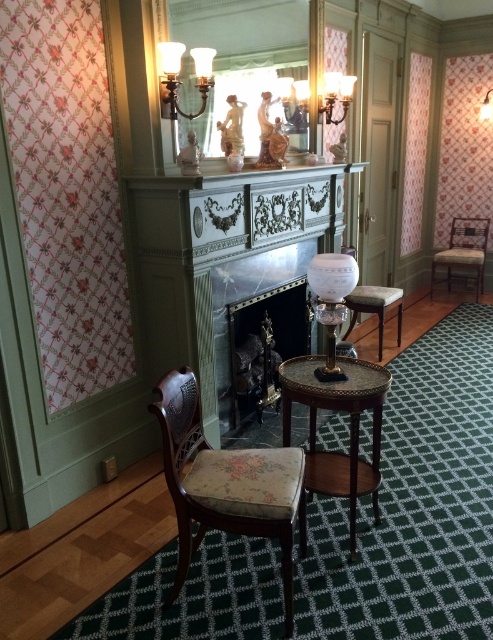
Is point (239, 170) less distant than point (176, 102)?

No, it is not.

Is point (188, 168) closer to viewer compared to point (183, 51)?

No, (188, 168) is behind (183, 51).

Find the location of a particular element. The image size is (493, 640). white marble fireplace at center is located at coordinates (235, 173).

Can you confirm if floral fabric armchair at lower left is bigger than wooden stool at center?

Actually, floral fabric armchair at lower left might be smaller than wooden stool at center.

Which of these two, floral fabric armchair at lower left or wooden stool at center, stands taller?

Standing taller between the two is floral fabric armchair at lower left.

Is point (289, 616) in front of point (353, 300)?

Yes, it is.

At what (x,y) coordinates should I click in order to perform the action: click on floral fabric armchair at lower left. Please return your answer as a coordinate pair (x, y). The height and width of the screenshot is (640, 493). Looking at the image, I should click on (226, 484).

Is wooden armchair at right wider than matte brass chandelier at upper center?

Correct, the width of wooden armchair at right exceeds that of matte brass chandelier at upper center.

What do you see at coordinates (463, 252) in the screenshot?
I see `wooden armchair at right` at bounding box center [463, 252].

Between point (442, 266) and point (205, 61), which one is positioned in front?

Point (205, 61) is in front.

Find the location of a particular element. wooden armchair at right is located at coordinates (463, 252).